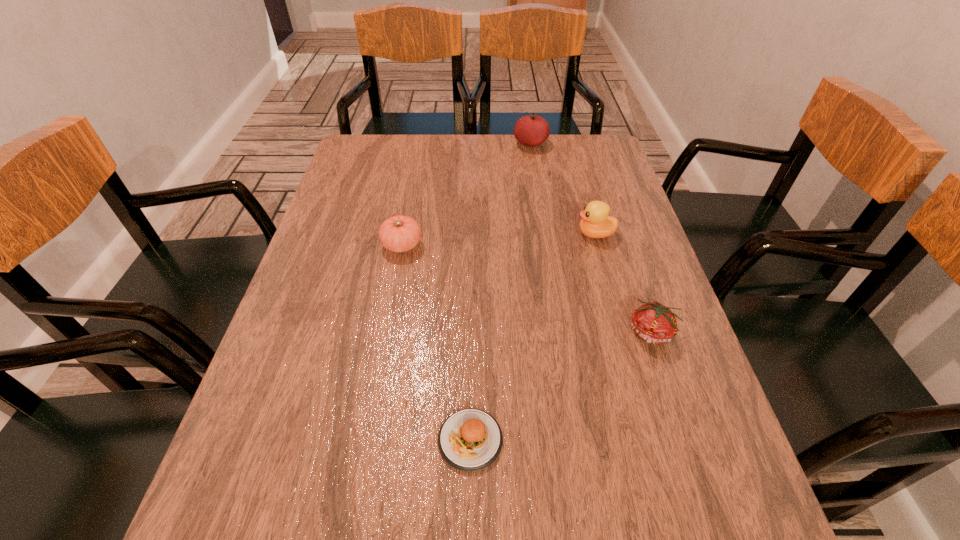
This screenshot has height=540, width=960. In the image, there is a desktop. Find the location of `vacant space at the left edge`. vacant space at the left edge is located at coordinates (376, 209).

Locate an element on the screen. The image size is (960, 540). free region at the right edge of the desktop is located at coordinates (629, 230).

The width and height of the screenshot is (960, 540). Find the location of `vacant space at the far left corner of the desktop`. vacant space at the far left corner of the desktop is located at coordinates (361, 159).

Where is `vacant area at the far right corner`? This screenshot has height=540, width=960. vacant area at the far right corner is located at coordinates (609, 157).

What are the coordinates of `vacant point located between the duckling and the second object from left to right` in the screenshot? It's located at (533, 337).

At what (x,y) coordinates should I click in order to perform the action: click on free area in between the duckling and the leftmost tomato. Please return your answer as a coordinate pair (x, y). Looking at the image, I should click on (498, 240).

I want to click on vacant area that lies between the second nearest object and the leftmost object, so click(x=527, y=289).

You are a GUI agent. You are given a task and a screenshot of the screen. Output one action in this format:
    pyautogui.click(x=<x>, y=<y>)
    Task: Click on the free space between the shortest object and the tallest tomato
    The width and height of the screenshot is (960, 540).
    Given the screenshot: What is the action you would take?
    pyautogui.click(x=500, y=292)

Locate an element on the screen. The image size is (960, 540). free spot between the nearest object and the nearest tomato is located at coordinates (561, 387).

The height and width of the screenshot is (540, 960). Identify the location of empty space that is in between the duckling and the rightmost tomato. (623, 284).